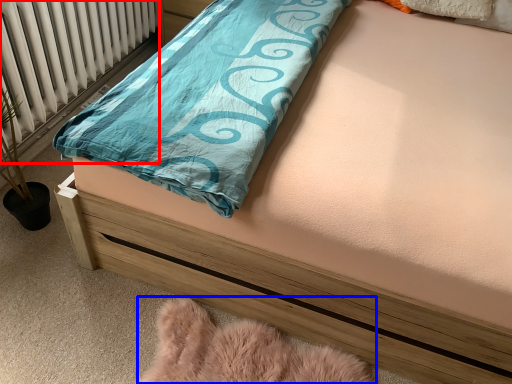
Question: Among these objects, which one is farthest to the camera, radiator (highlighted by a red box) or material (highlighted by a blue box)?

Choices:
 (A) radiator
 (B) material

Answer: (A)